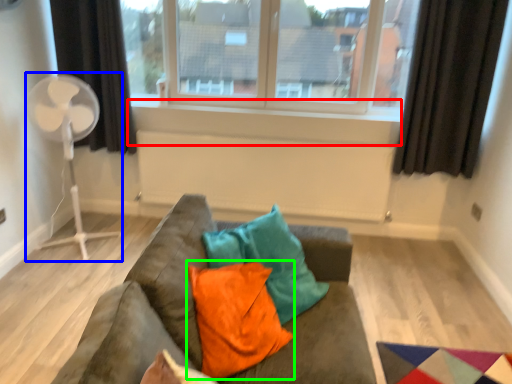
Question: Based on their relative distances, which object is nearer to window sill (highlighted by a red box)? Choose from fan (highlighted by a blue box) and pillow (highlighted by a green box).

Choices:
 (A) fan
 (B) pillow

Answer: (A)